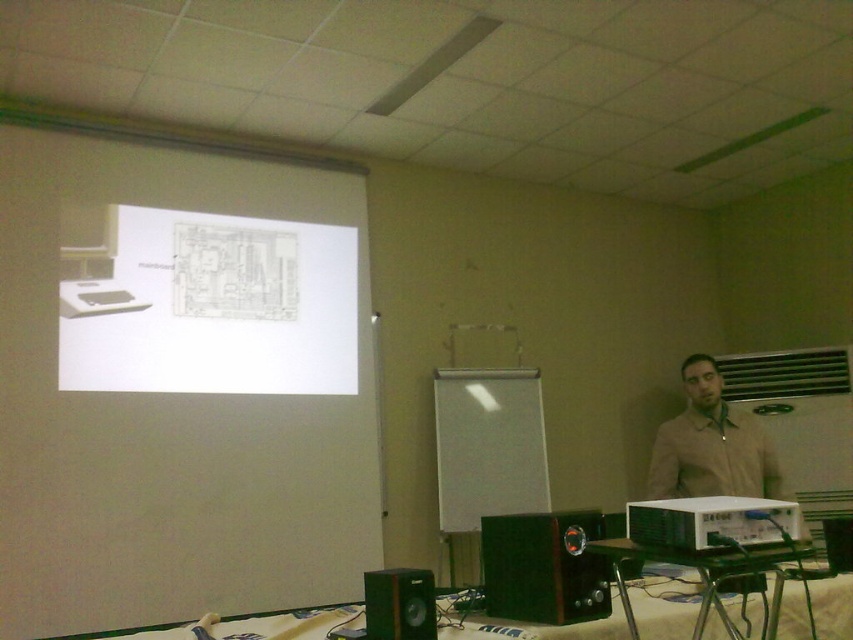
From the picture: You are an attendee in the classroom and want to point out the white paper at upper left to the presenter. Which side of the white plastic projector at center should you indicate?

The white paper at upper left is to the left of the white plastic projector at center, so you should indicate the left side of the white plastic projector at center.

You are sitting in the classroom and want to look at both the white plastic projector at center and the beige fabric shirt at right without moving your head. Which object should you focus on first to see both in your field of view?

You should focus on the white plastic projector at center first because the beige fabric shirt at right is to the right of it, so by centering your view on the projector, you can still see the shirt to the right within your field of view.

You are a student sitting in the classroom and need to locate the black plastic speaker at lower center and the beige fabric shirt at right. Which object is smaller in size?

The black plastic speaker at lower center is smaller in size compared to the beige fabric shirt at right.